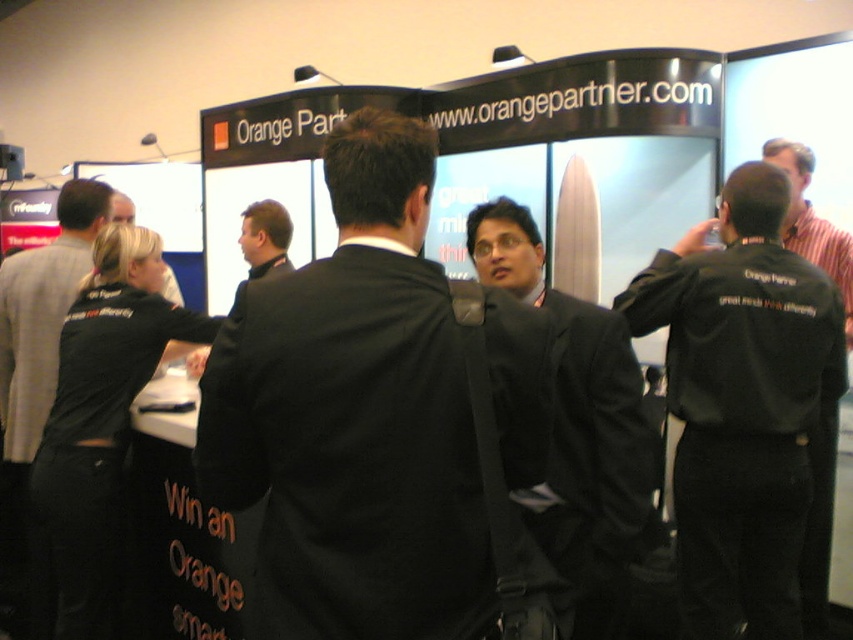
Is point (408, 506) positioned before point (13, 522)?

That is True.

Which is more to the right, black fabric suit at center or black fabric shirt at left?

Positioned to the right is black fabric suit at center.

Does point (198, 470) lie in front of point (15, 420)?

Yes, it is in front of point (15, 420).

Find the location of a particular element. black fabric suit at center is located at coordinates (354, 417).

Does black fabric jacket at upper right have a greater height compared to black fabric business suit at left?

Correct, black fabric jacket at upper right is much taller as black fabric business suit at left.

At what (x,y) coordinates should I click in order to perform the action: click on black fabric jacket at upper right. Please return your answer as a coordinate pair (x, y). The image size is (853, 640). Looking at the image, I should click on (746, 406).

This screenshot has width=853, height=640. I want to click on black fabric jacket at upper right, so click(746, 406).

Does black fabric suit at center appear on the right side of black fabric business suit at left?

Correct, you'll find black fabric suit at center to the right of black fabric business suit at left.

Does black fabric suit at center have a greater width compared to black fabric business suit at left?

Yes.

Who is more distant from viewer, (386,266) or (83,396)?

The point (83,396) is more distant.

Identify the location of black fabric suit at center. (354, 417).